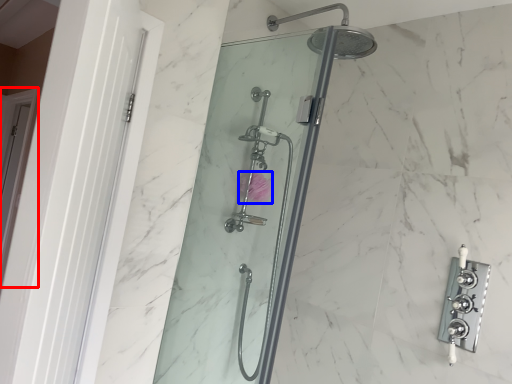
Question: Which of the following is the closest to the observer, screen door (highlighted by a red box) or flower (highlighted by a blue box)?

Choices:
 (A) screen door
 (B) flower

Answer: (B)